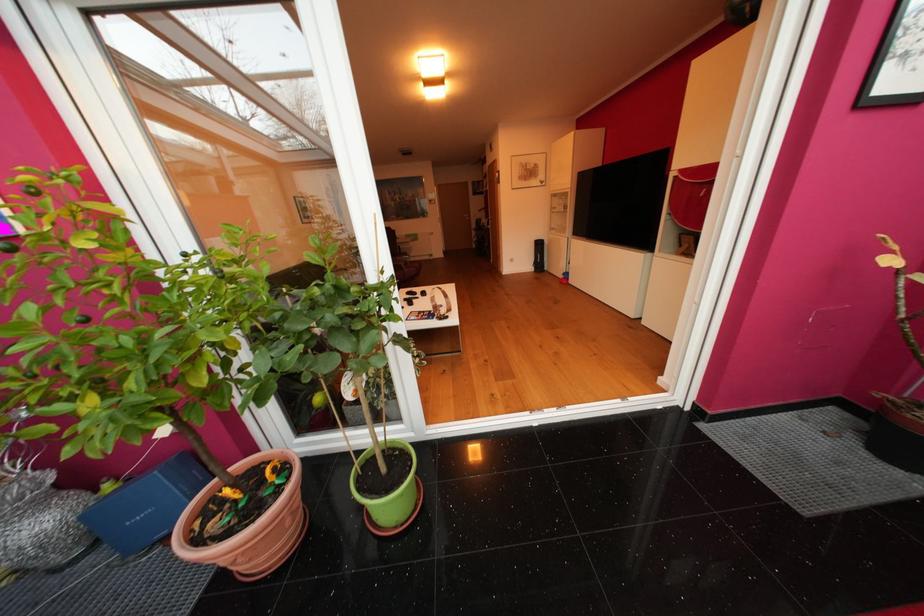
You are a GUI agent. You are given a task and a screenshot of the screen. Output one action in this format:
    pyautogui.click(x=<x>, y=<y>)
    Task: Click on the dark chair sitting surface
    The height and width of the screenshot is (616, 924).
    Given the screenshot: What is the action you would take?
    pyautogui.click(x=406, y=270)